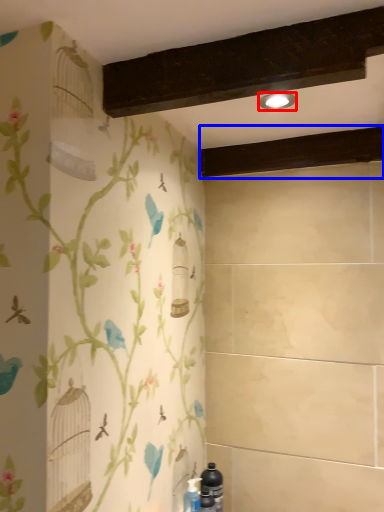
Question: Which object appears farthest to the camera in this image, light fixture (highlighted by a red box) or plank (highlighted by a blue box)?

Choices:
 (A) light fixture
 (B) plank

Answer: (B)